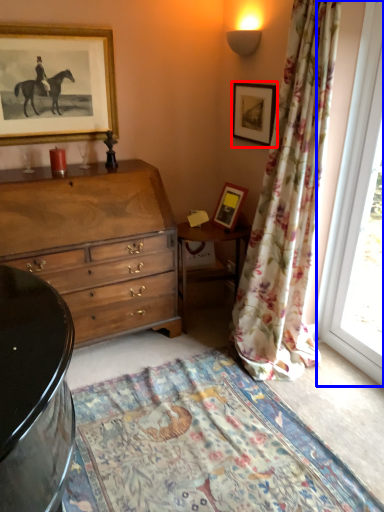
Question: Which object appears closest to the camera in this image, picture frame (highlighted by a red box) or window (highlighted by a blue box)?

Choices:
 (A) picture frame
 (B) window

Answer: (B)